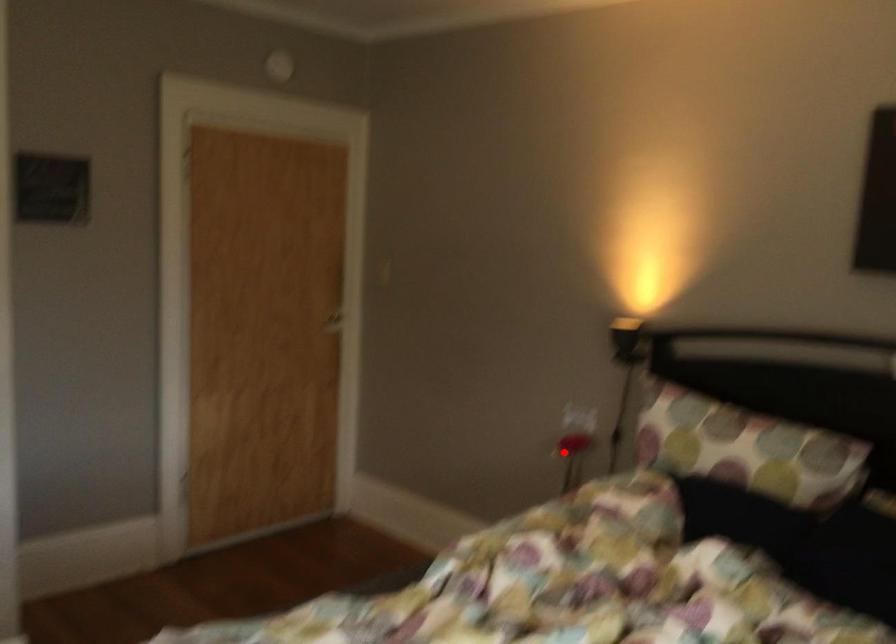
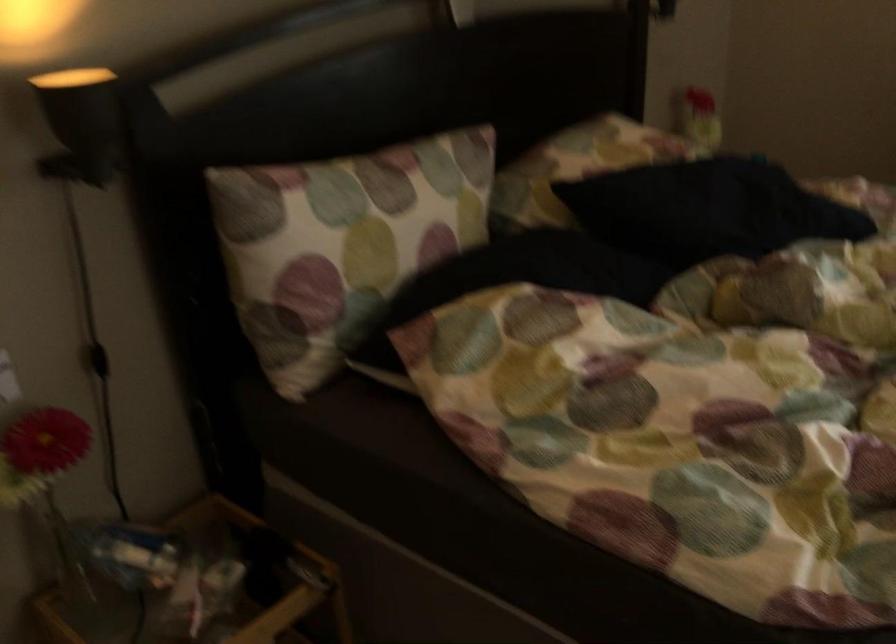
The point at the highlighted location is marked in the first image. Where is the corresponding point in the second image?

(46, 480)